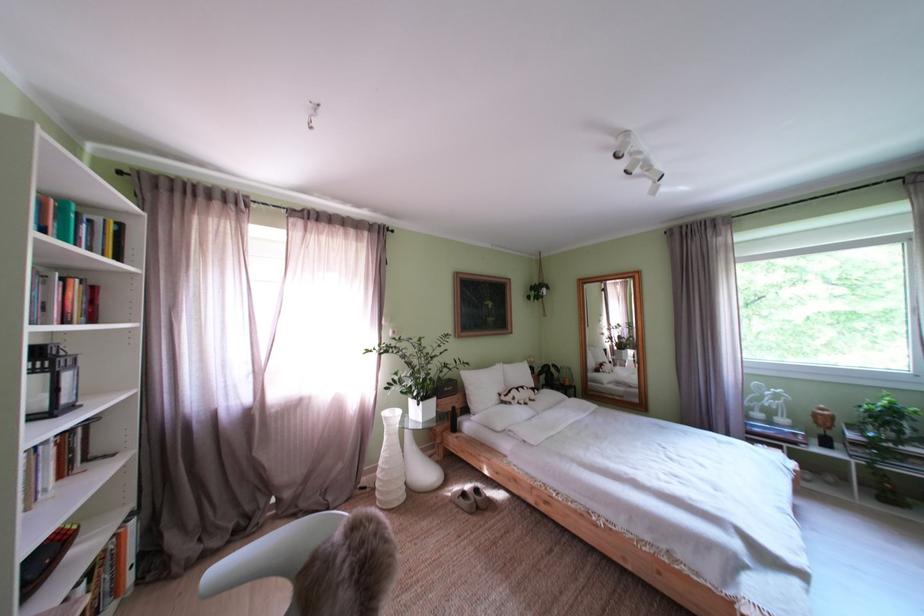
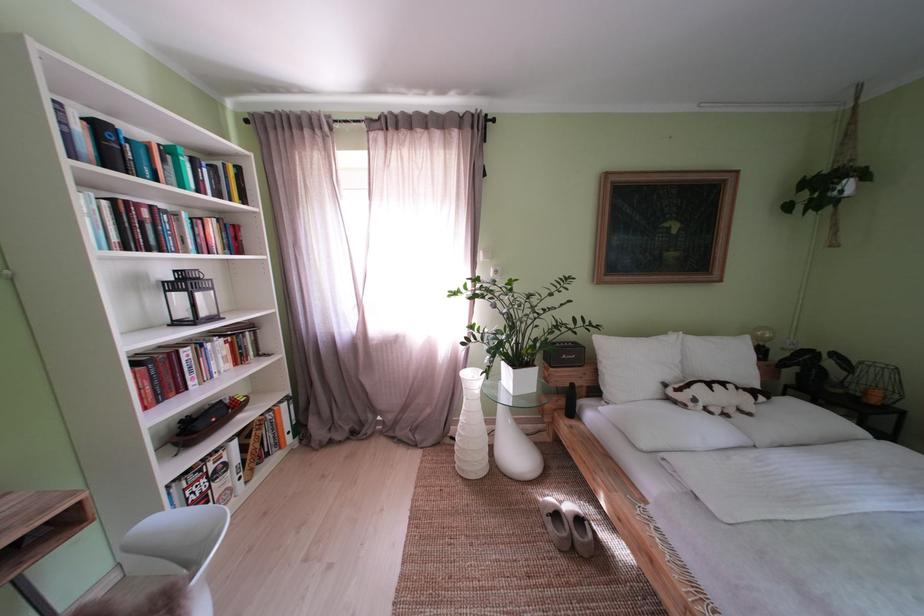
In the second image, find the point that corresponds to point (457, 503) in the first image.

(546, 506)